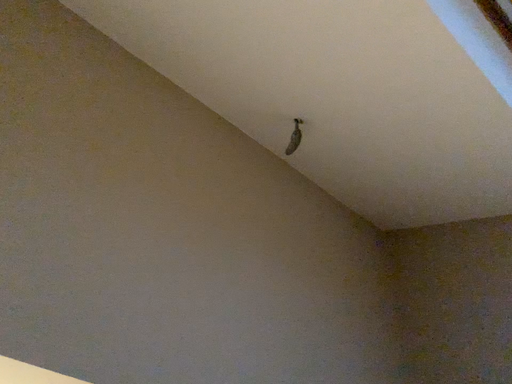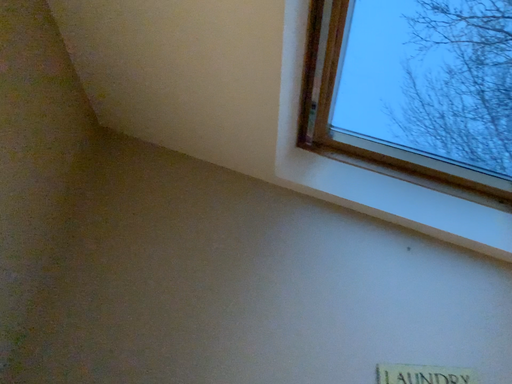
Question: How did the camera likely rotate when shooting the video?

Choices:
 (A) rotated upward
 (B) rotated downward

Answer: (B)